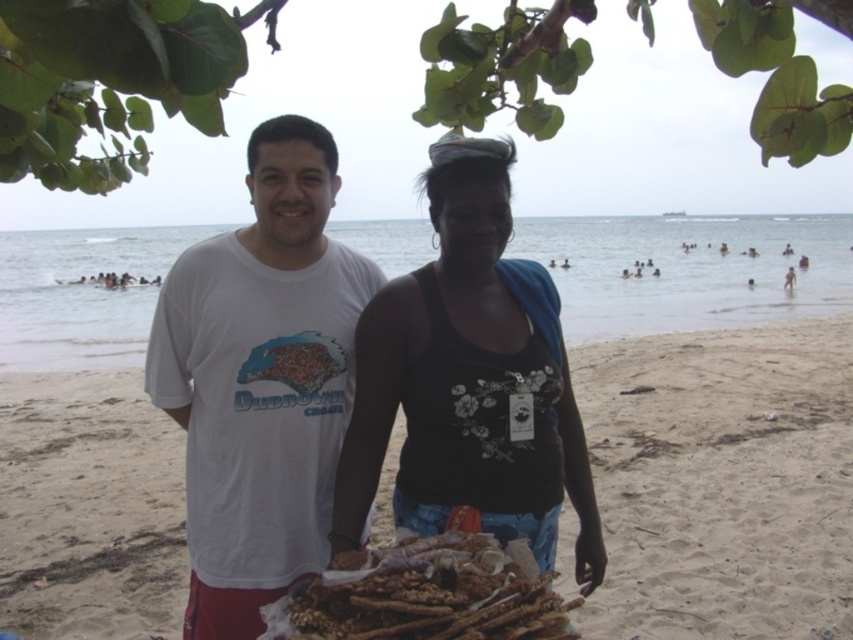
Question: Is white cotton t-shirt at center closer to the viewer compared to brown textured breadsticks at center?

Choices:
 (A) yes
 (B) no

Answer: (B)

Question: Which of the following is the closest to the observer?

Choices:
 (A) (263, 448)
 (B) (555, 403)

Answer: (A)

Question: Which of the following is the closest to the observer?

Choices:
 (A) click(329, 136)
 (B) click(363, 509)
 (C) click(158, 525)
 (D) click(840, 10)

Answer: (D)

Question: Is white cotton t-shirt at center behind green leafy tree at upper center?

Choices:
 (A) yes
 (B) no

Answer: (A)

Question: Which of these objects is positioned closest to the brown textured breadsticks at center?

Choices:
 (A) floral printed tank top at center
 (B) white cotton t-shirt at center

Answer: (A)

Question: Can you confirm if white cotton t-shirt at center is positioned below green leafy tree at upper center?

Choices:
 (A) yes
 (B) no

Answer: (A)